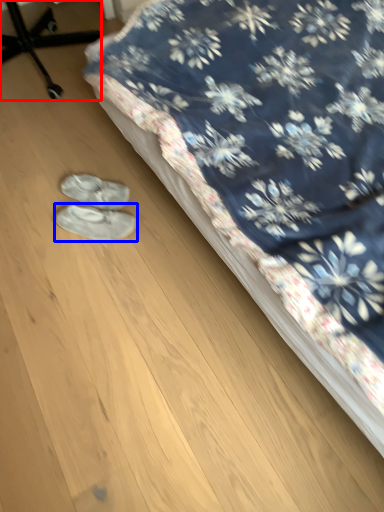
Question: Which object appears closest to the camera in this image, furniture (highlighted by a red box) or footwear (highlighted by a blue box)?

Choices:
 (A) furniture
 (B) footwear

Answer: (B)